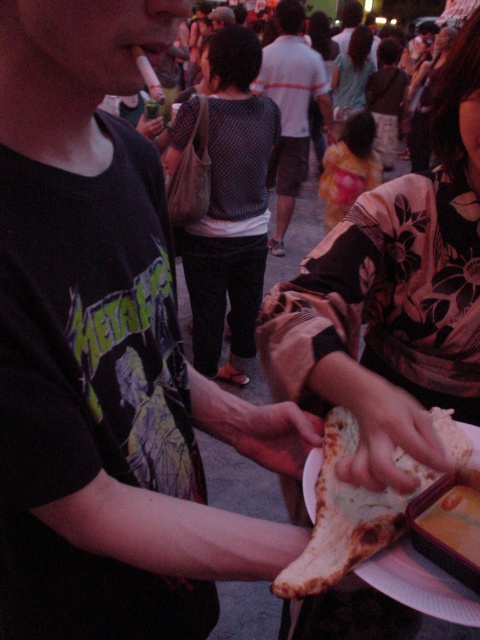
In the scene shown: What is the color of the shirt at the point labeled as point (290,109)?

The point (290,109) is on white cotton shirt at center, so the color is white.

You are at a festival and see a smooth white bread at center and a floral fabric dress at upper right. Which object is closer to the bottom of the image?

The smooth white bread at center is closer to the bottom of the image because it is positioned under the floral fabric dress at upper right.

You are attending a night festival and see two items in the scene. One is the smooth white bread at center and the other is the floral fabric dress at upper right. Which item has a smaller thickness?

The smooth white bread at center is thinner than the floral fabric dress at upper right.